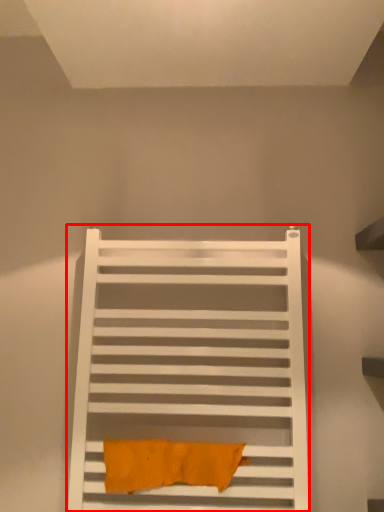
Question: Where is furniture (annotated by the red box) located in relation to bath towel in the image?

Choices:
 (A) right
 (B) left

Answer: (B)